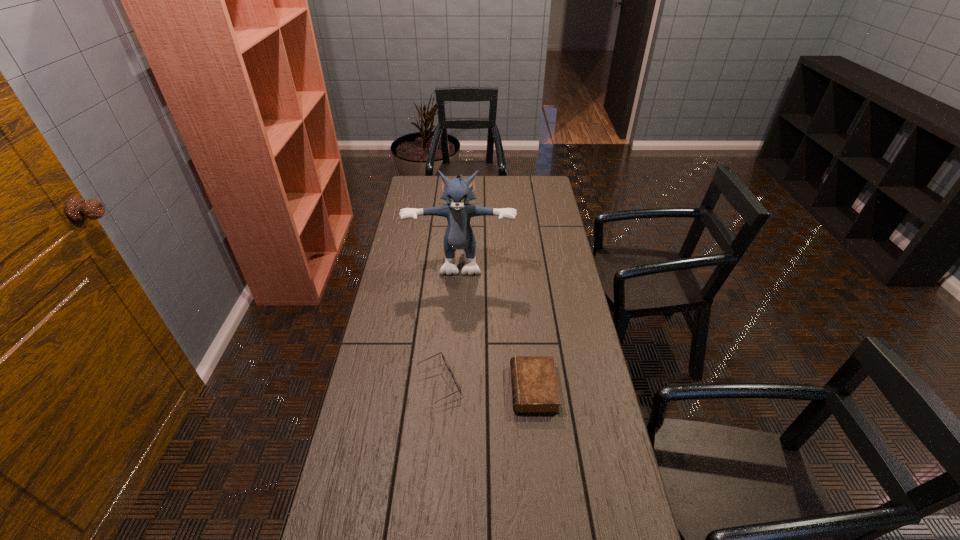
The height and width of the screenshot is (540, 960). Find the location of `object that is positioned at the right edge`. object that is positioned at the right edge is located at coordinates (535, 389).

At what (x,y) coordinates should I click in order to perform the action: click on vacant space at the left edge of the desktop. Please return your answer as a coordinate pair (x, y). Looking at the image, I should click on (434, 206).

Locate an element on the screen. The height and width of the screenshot is (540, 960). vacant region at the right edge of the desktop is located at coordinates (563, 234).

Find the location of a particular element. free space at the far right corner of the desktop is located at coordinates (543, 182).

You are a GUI agent. You are given a task and a screenshot of the screen. Output one action in this format:
    pyautogui.click(x=<x>, y=<y>)
    Task: Click on the vacant area between the diary and the cat
    Image resolution: width=960 pixels, height=540 pixels.
    Given the screenshot: What is the action you would take?
    497,323

At what (x,y) coordinates should I click in order to perform the action: click on empty space that is in between the cat and the spectacles. Please return your answer as a coordinate pair (x, y). Looking at the image, I should click on (450, 321).

Locate an element on the screen. empty location between the diary and the farthest object is located at coordinates (497, 323).

In order to click on free space between the spectacles and the tallest object in this screenshot , I will do `click(450, 321)`.

Image resolution: width=960 pixels, height=540 pixels. Identify the location of blank region between the tallest object and the diary. (497, 323).

Identify the location of vacant point located between the diary and the spectacles. (486, 386).